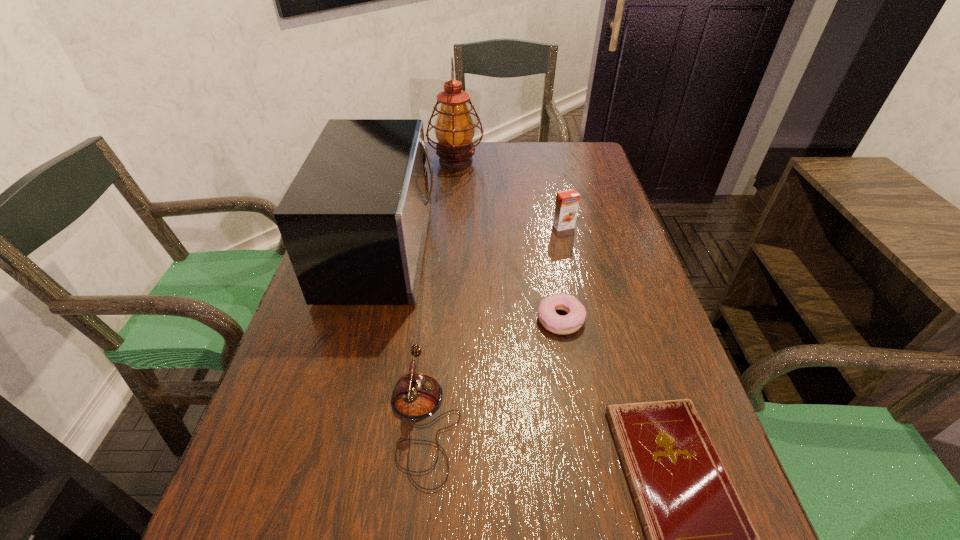
The height and width of the screenshot is (540, 960). I want to click on vacant space located 0.100m on the back of the fifth tallest object, so click(x=552, y=272).

This screenshot has width=960, height=540. What are the coordinates of `object that is at the far edge` in the screenshot? It's located at (454, 129).

In order to click on object at the left edge in this screenshot , I will do `click(354, 220)`.

Identify the location of orange juice that is at the right edge. (566, 207).

Locate an element on the screen. This screenshot has width=960, height=540. doughnut present at the right edge is located at coordinates (551, 321).

The height and width of the screenshot is (540, 960). I want to click on vacant space at the far edge, so click(504, 154).

Find the location of `vacant space at the left edge of the desktop`. vacant space at the left edge of the desktop is located at coordinates (330, 339).

Locate an element on the screen. This screenshot has width=960, height=540. vacant space at the right edge of the desktop is located at coordinates (598, 188).

Where is `free region at the far right corner of the desktop`? This screenshot has height=540, width=960. free region at the far right corner of the desktop is located at coordinates (582, 161).

In order to click on free space between the farthest object and the orange juice in this screenshot , I will do `click(510, 193)`.